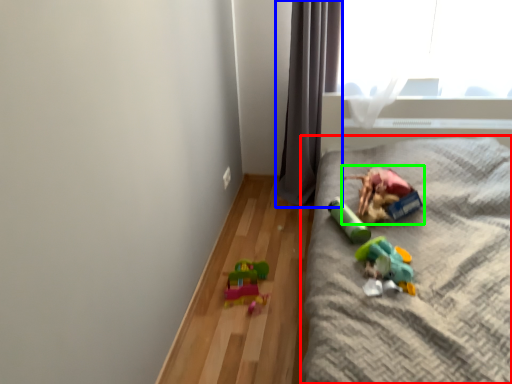
Question: Which object is positioned farthest from furniture (highlighted by a red box)? Select from curtain (highlighted by a blue box) and toy (highlighted by a green box).

Choices:
 (A) curtain
 (B) toy

Answer: (A)